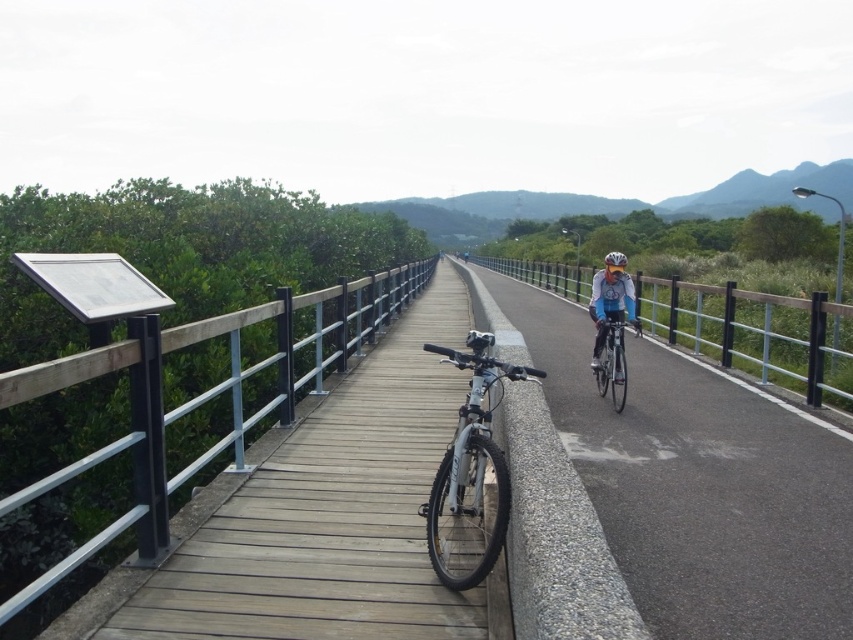
Question: Does wooden rail at left have a smaller size compared to matte black helmet at center?

Choices:
 (A) no
 (B) yes

Answer: (B)

Question: Does metal/textured rail at right have a larger size compared to matte black helmet at center?

Choices:
 (A) yes
 (B) no

Answer: (A)

Question: Which object appears closest to the camera in this image?

Choices:
 (A) wooden boardwalk at center
 (B) smooth asphalt road at center
 (C) silver metallic bicycle at center
 (D) shiny silver bicycle at center

Answer: (A)

Question: Is wooden boardwalk at center positioned before smooth asphalt road at center?

Choices:
 (A) yes
 (B) no

Answer: (A)

Question: Considering the real-world distances, which object is farthest from the white matte helmet at center?

Choices:
 (A) matte black helmet at center
 (B) wooden boardwalk at center
 (C) smooth asphalt road at center

Answer: (B)

Question: Which point is farther to the camera?

Choices:
 (A) wooden boardwalk at center
 (B) silver metallic bicycle at center
 (C) matte black helmet at center
 (D) metal/textured rail at right

Answer: (C)